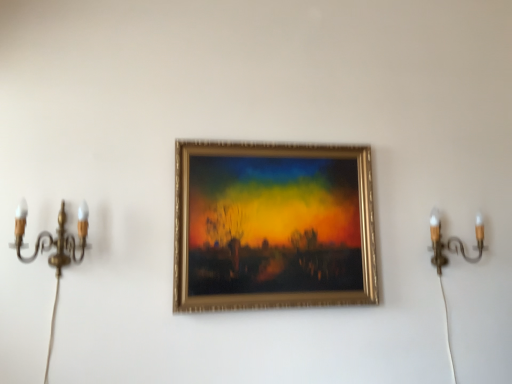
You are a GUI agent. You are given a task and a screenshot of the screen. Output one action in this format:
    pyautogui.click(x=<x>, y=<y>)
    Task: Click on the gold metallic candle holder at right, marked as the first candle holder in a back-to-front arrangement
    The image size is (512, 384).
    Given the screenshot: What is the action you would take?
    pyautogui.click(x=453, y=241)

From a real-world perspective, which object stands above the other?

In real-world perspective, gold brass candle holder at left, the second candle holder positioned from the back, is above.

Which object is wider, gold metallic candle holder at right, the second candle holder when ordered from left to right, or gold brass candle holder at left, arranged as the 1th candle holder when viewed from the left?

gold metallic candle holder at right, the second candle holder when ordered from left to right, is wider.

Which object is further away from the camera, gold brass candle holder at left, placed as the second candle holder when sorted from right to left, or gold metallic candle holder at right, marked as the first candle holder in a back-to-front arrangement?

gold metallic candle holder at right, marked as the first candle holder in a back-to-front arrangement, is more distant.

Which object is positioned more to the left, gold brass candle holder at left, which is counted as the first candle holder, starting from the front, or gold metallic candle holder at right, the second candle holder when ordered from left to right?

Positioned to the left is gold brass candle holder at left, which is counted as the first candle holder, starting from the front.

Is gold metallic candle holder at right, marked as the first candle holder in a back-to-front arrangement, surrounded by gold brass candle holder at left, which is counted as the first candle holder, starting from the front?

No, gold metallic candle holder at right, marked as the first candle holder in a back-to-front arrangement, is not surrounded by gold brass candle holder at left, which is counted as the first candle holder, starting from the front.

From a real-world perspective, which is physically below, gold brass candle holder at left, the second candle holder positioned from the back, or gold metallic candle holder at right, which is the 1th candle holder from right to left?

gold metallic candle holder at right, which is the 1th candle holder from right to left, from a real-world perspective.

Based on their sizes in the image, would you say gold metallic candle holder at right, the second candle holder when ordered from left to right, is bigger or smaller than gold metallic picture frame at center?

In the image, gold metallic candle holder at right, the second candle holder when ordered from left to right, appears to be smaller than gold metallic picture frame at center.

The image size is (512, 384). Find the location of `candle holder behind the gold metallic picture frame at center`. candle holder behind the gold metallic picture frame at center is located at coordinates (453, 241).

In terms of width, does gold metallic candle holder at right, the 2th candle holder viewed from the front, look wider or thinner when compared to gold metallic picture frame at center?

Clearly, gold metallic candle holder at right, the 2th candle holder viewed from the front, has more width compared to gold metallic picture frame at center.

Which object is positioned more to the left, gold metallic picture frame at center or gold metallic candle holder at right, the 2th candle holder viewed from the front?

Positioned to the left is gold metallic picture frame at center.

How much distance is there between gold metallic picture frame at center and gold metallic candle holder at right, the second candle holder when ordered from left to right?

A distance of 25.16 inches exists between gold metallic picture frame at center and gold metallic candle holder at right, the second candle holder when ordered from left to right.

Is there a large distance between gold metallic picture frame at center and gold metallic candle holder at right, marked as the first candle holder in a back-to-front arrangement?

No, there isn't a large distance between gold metallic picture frame at center and gold metallic candle holder at right, marked as the first candle holder in a back-to-front arrangement.

The image size is (512, 384). I want to click on picture frame on the left of gold metallic candle holder at right, which is the 1th candle holder from right to left, so click(273, 226).

Considering the points (358, 170) and (71, 235), which point is in front, point (358, 170) or point (71, 235)?

The point (71, 235) is closer to the camera.

Is gold metallic picture frame at center shorter than gold brass candle holder at left, arranged as the 1th candle holder when viewed from the left?

No.

Would you say gold brass candle holder at left, placed as the second candle holder when sorted from right to left, is part of gold metallic picture frame at center's contents?

Actually, gold brass candle holder at left, placed as the second candle holder when sorted from right to left, is outside gold metallic picture frame at center.

This screenshot has width=512, height=384. In order to click on candle holder located in front of the gold metallic picture frame at center in this screenshot , I will do `click(52, 237)`.

Is point (41, 238) positioned in front of point (298, 156)?

Yes, it is.

Which object is wider, gold brass candle holder at left, placed as the second candle holder when sorted from right to left, or gold metallic picture frame at center?

With larger width is gold brass candle holder at left, placed as the second candle holder when sorted from right to left.

From the image's perspective, which one is positioned lower, gold brass candle holder at left, placed as the second candle holder when sorted from right to left, or gold metallic picture frame at center?

gold brass candle holder at left, placed as the second candle holder when sorted from right to left, is shown below in the image.

Considering the relative sizes of gold brass candle holder at left, the second candle holder positioned from the back, and gold metallic picture frame at center in the image provided, is gold brass candle holder at left, the second candle holder positioned from the back, smaller than gold metallic picture frame at center?

Correct, gold brass candle holder at left, the second candle holder positioned from the back, occupies less space than gold metallic picture frame at center.

This screenshot has height=384, width=512. I want to click on candle holder on the left of the gold metallic candle holder at right, which is the 1th candle holder from right to left, so click(x=52, y=237).

The image size is (512, 384). Find the location of `candle holder above the gold metallic candle holder at right, the 2th candle holder viewed from the front (from the image's perspective)`. candle holder above the gold metallic candle holder at right, the 2th candle holder viewed from the front (from the image's perspective) is located at coordinates (52, 237).

Which object lies nearer to the anchor point gold metallic candle holder at right, the 2th candle holder viewed from the front, gold brass candle holder at left, the second candle holder positioned from the back, or gold metallic picture frame at center?

The object closer to gold metallic candle holder at right, the 2th candle holder viewed from the front, is gold metallic picture frame at center.

When comparing their distances from gold brass candle holder at left, which is counted as the first candle holder, starting from the front, does gold metallic picture frame at center or gold metallic candle holder at right, the second candle holder when ordered from left to right, seem further?

gold metallic candle holder at right, the second candle holder when ordered from left to right, lies further to gold brass candle holder at left, which is counted as the first candle holder, starting from the front, than the other object.

Looking at this image, looking at the image, which one is located further to gold metallic candle holder at right, marked as the first candle holder in a back-to-front arrangement, gold metallic picture frame at center or gold brass candle holder at left, placed as the second candle holder when sorted from right to left?

The object further to gold metallic candle holder at right, marked as the first candle holder in a back-to-front arrangement, is gold brass candle holder at left, placed as the second candle holder when sorted from right to left.

Estimate the real-world distances between objects in this image. Which object is further from gold metallic picture frame at center, gold metallic candle holder at right, the second candle holder when ordered from left to right, or gold brass candle holder at left, placed as the second candle holder when sorted from right to left?

gold brass candle holder at left, placed as the second candle holder when sorted from right to left, lies further to gold metallic picture frame at center than the other object.

Looking at this image, from the image, which object appears to be farther from gold brass candle holder at left, the second candle holder positioned from the back, gold metallic candle holder at right, the second candle holder when ordered from left to right, or gold metallic picture frame at center?

gold metallic candle holder at right, the second candle holder when ordered from left to right.

Based on the photo, looking at the image, which one is located closer to gold metallic picture frame at center, gold brass candle holder at left, which is counted as the first candle holder, starting from the front, or gold metallic candle holder at right, the 2th candle holder viewed from the front?

Among the two, gold metallic candle holder at right, the 2th candle holder viewed from the front, is located nearer to gold metallic picture frame at center.

At what (x,y) coordinates should I click in order to perform the action: click on picture frame located between gold brass candle holder at left, placed as the second candle holder when sorted from right to left, and gold metallic candle holder at right, which is the 1th candle holder from right to left, in the left-right direction. Please return your answer as a coordinate pair (x, y). The image size is (512, 384). Looking at the image, I should click on (273, 226).